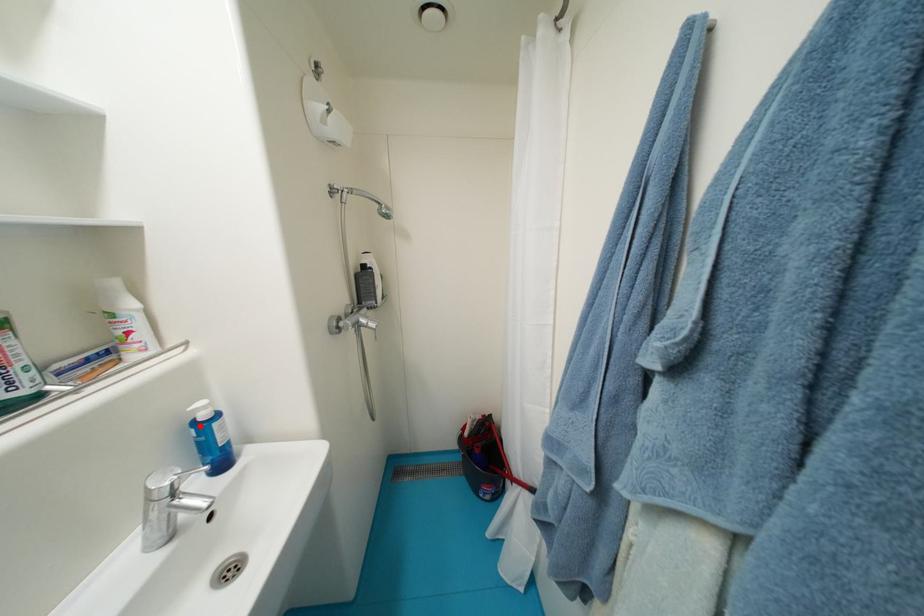
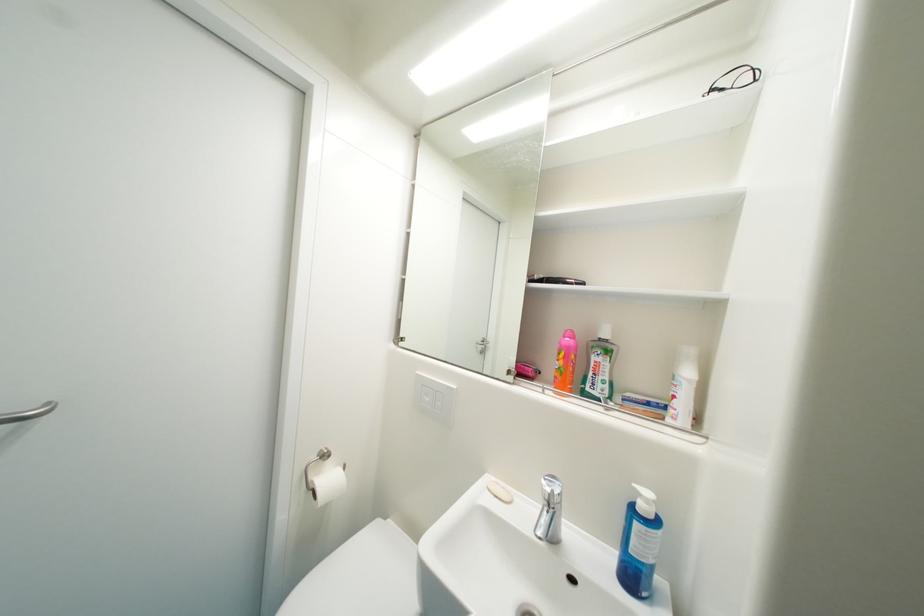
Locate, in the second image, the point that corresponds to the highlighted location in the first image.

(641, 507)